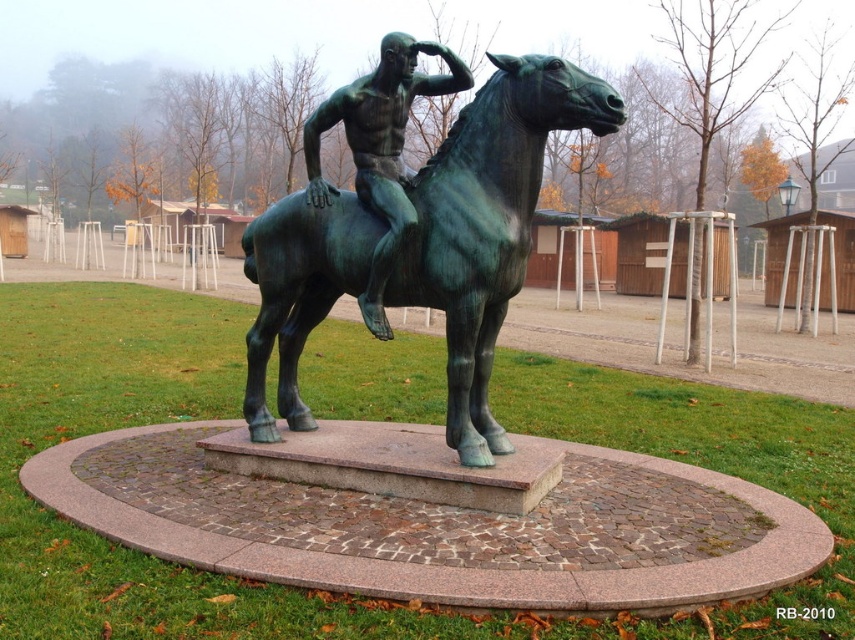
You are standing in front of the statue and want to take a photo of both the green patina horse at center and the green patina statue at center. Which direction should you move to ensure both are fully visible in your camera frame?

You should move to the left side so that both the green patina horse at center and the green patina statue at center are fully visible in your camera frame since the horse is positioned to the right of the statue.

You are standing in front of the statue and want to touch the green patina horse at center and the green patina statue at center. Which one can you reach first without moving your position?

The green patina horse at center is closer to the viewer than the green patina statue at center, so you can reach the green patina horse at center first without moving.